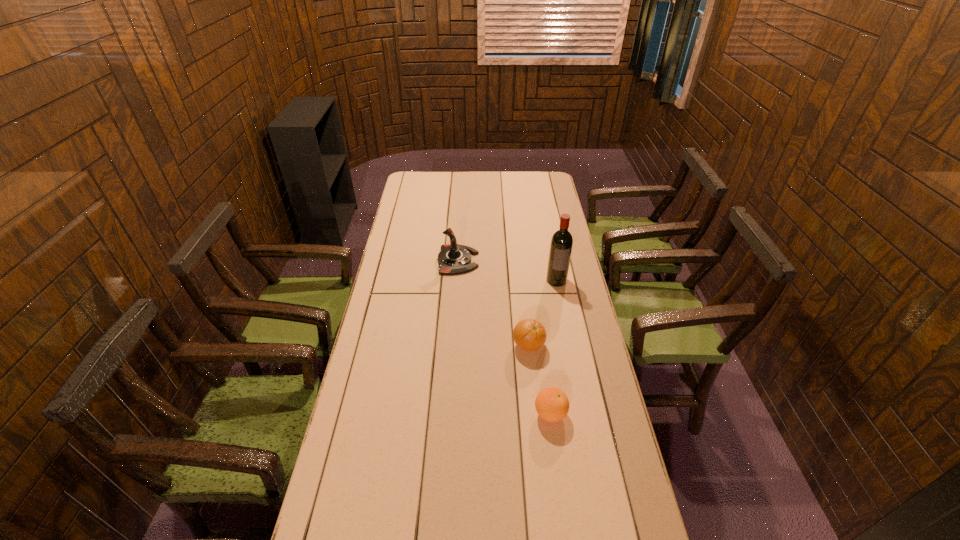
This screenshot has width=960, height=540. What are the coordinates of `vacant position in the image that satisfies the following two spatial constraints: 1. on the handle side of the third farthest object; 2. on the left side of the second tallest object` in the screenshot? It's located at (452, 346).